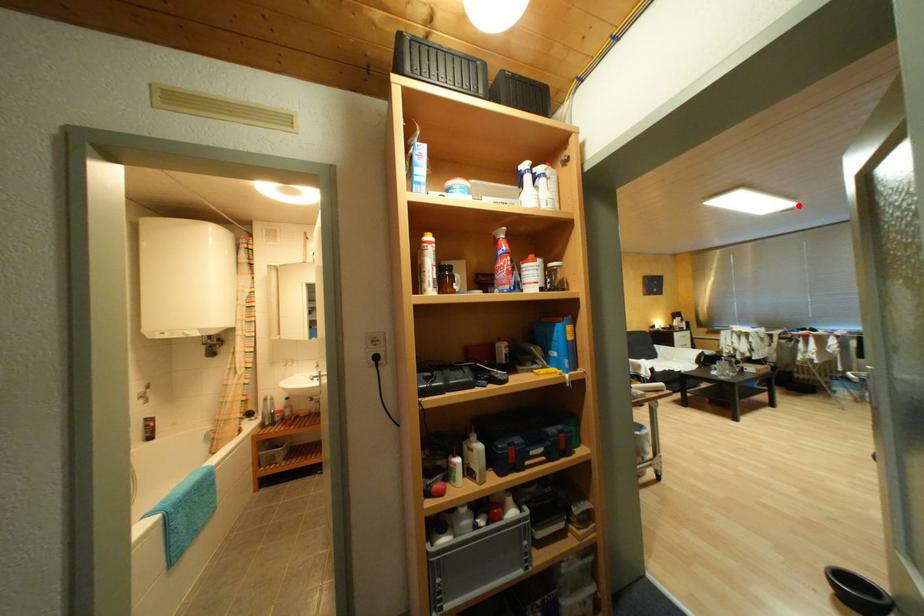
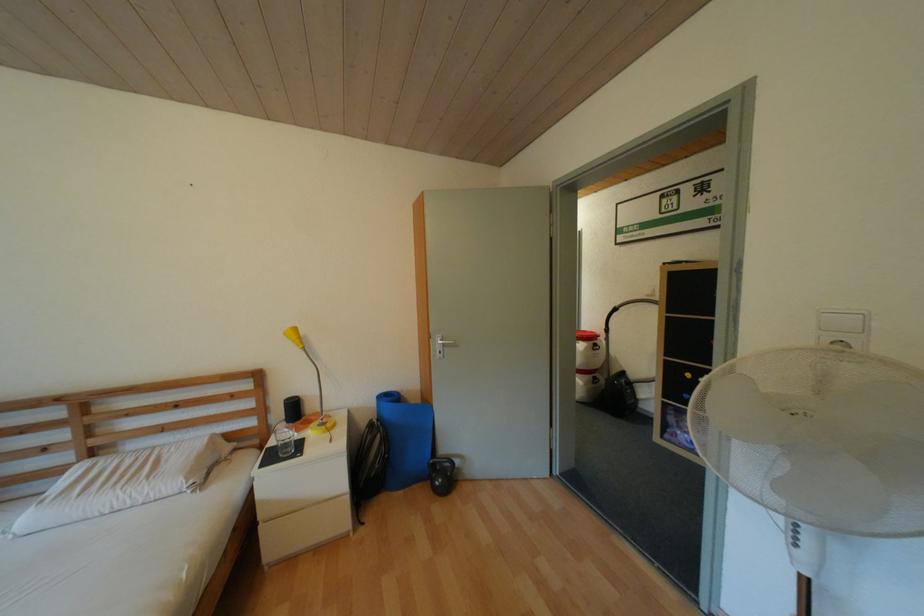
Question: I am providing you with two images of the same scene from different viewpoints. A red point is marked on the first image. Can you still see the location of the red point in image 2?

Choices:
 (A) Yes
 (B) No

Answer: (B)